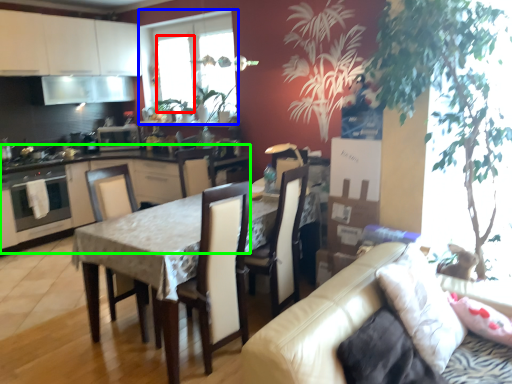
Question: Which object is the closest to the window screen (highlighted by a red box)? Choose among these: window (highlighted by a blue box) or cabinetry (highlighted by a green box).

Choices:
 (A) window
 (B) cabinetry

Answer: (A)